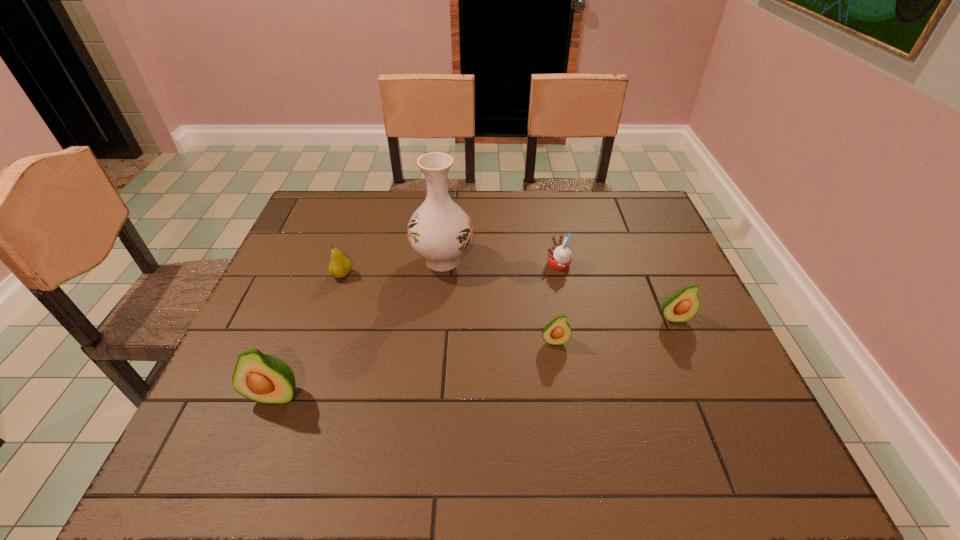
I want to click on the nearest object, so click(x=264, y=378).

I want to click on the nearest avocado, so click(x=264, y=378).

Identify the location of the second farthest avocado. The width and height of the screenshot is (960, 540). (557, 332).

Find the location of a particular element. This screenshot has height=540, width=960. the second avocado from right to left is located at coordinates (557, 332).

Where is `the third nearest object`? Image resolution: width=960 pixels, height=540 pixels. the third nearest object is located at coordinates (681, 306).

Find the location of a particular element. This screenshot has height=540, width=960. the rightmost object is located at coordinates pyautogui.click(x=681, y=306).

Image resolution: width=960 pixels, height=540 pixels. I want to click on the third object from left to right, so click(439, 230).

Where is `vase`? Image resolution: width=960 pixels, height=540 pixels. vase is located at coordinates (439, 230).

Locate an element on the screen. This screenshot has height=540, width=960. pear is located at coordinates (339, 267).

Locate an element on the screen. Image resolution: width=960 pixels, height=540 pixels. muffin is located at coordinates (559, 255).